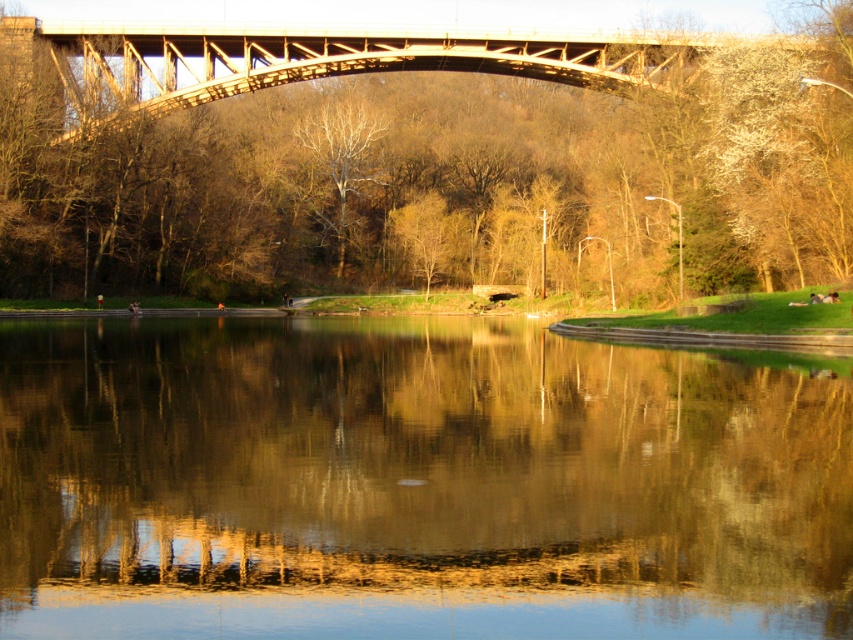
Question: Which point is closer to the camera?

Choices:
 (A) (657, 72)
 (B) (549, 492)
 (C) (534, 140)

Answer: (B)

Question: Is the position of smooth reflective water at center more distant than that of smooth brown tree at center?

Choices:
 (A) no
 (B) yes

Answer: (A)

Question: Does smooth reflective water at center lie in front of smooth brown tree at center?

Choices:
 (A) yes
 (B) no

Answer: (A)

Question: Does smooth reflective water at center appear on the right side of smooth brown tree at center?

Choices:
 (A) yes
 (B) no

Answer: (B)

Question: Which is nearer to the metallic bridge at upper center?

Choices:
 (A) smooth reflective water at center
 (B) smooth brown tree at center

Answer: (B)

Question: Estimate the real-world distances between objects in this image. Which object is farther from the smooth reflective water at center?

Choices:
 (A) metallic bridge at upper center
 (B) smooth brown tree at center

Answer: (B)